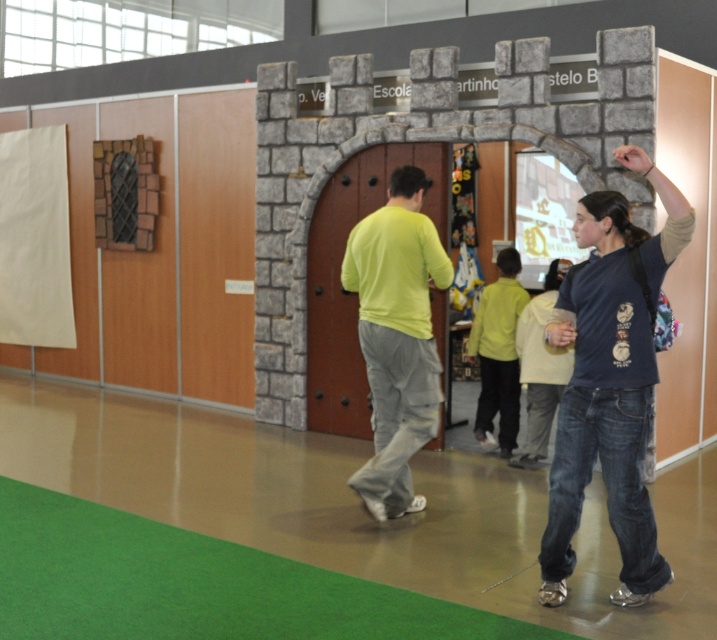
Question: Based on their relative distances, which object is nearer to the light yellow sweater at center?

Choices:
 (A) matte green shirt at center
 (B) dark blue t-shirt at right
 (C) light green fabric shirt at center

Answer: (A)

Question: Which point is closer to the camera?

Choices:
 (A) dark blue t-shirt at right
 (B) matte green shirt at center
 (C) light yellow sweater at center
 (D) light green fabric shirt at center

Answer: (A)

Question: Which object is the farthest from the light yellow sweater at center?

Choices:
 (A) light green fabric shirt at center
 (B) matte green shirt at center
 (C) dark blue t-shirt at right

Answer: (C)

Question: From the image, what is the correct spatial relationship of light green fabric shirt at center in relation to matte green shirt at center?

Choices:
 (A) left
 (B) right

Answer: (A)

Question: Does dark blue t-shirt at right appear over light green fabric shirt at center?

Choices:
 (A) no
 (B) yes

Answer: (A)

Question: Can you confirm if dark blue t-shirt at right is positioned to the right of light green fabric shirt at center?

Choices:
 (A) yes
 (B) no

Answer: (A)